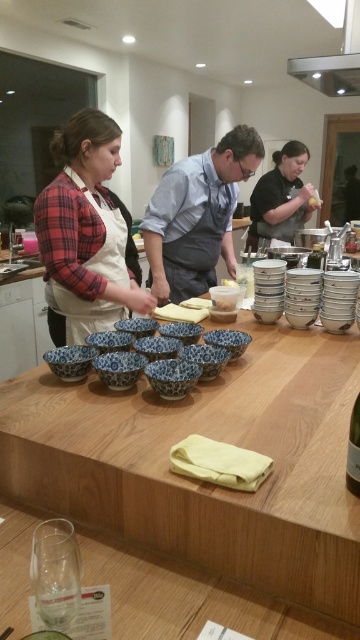
Question: Is wooden table at center to the left of plaid shirt at center from the viewer's perspective?

Choices:
 (A) no
 (B) yes

Answer: (A)

Question: Is wooden table at lower center to the left of blue cotton apron at center from the viewer's perspective?

Choices:
 (A) yes
 (B) no

Answer: (A)

Question: Is plaid shirt at center wider than black matte apron at center?

Choices:
 (A) yes
 (B) no

Answer: (B)

Question: Which point is closer to the camera taking this photo?

Choices:
 (A) tap(261, 342)
 (B) tap(348, 16)
 (C) tap(279, 179)
 (D) tap(173, 586)

Answer: (D)

Question: Which point appears farthest from the camera in this image?

Choices:
 (A) (70, 525)
 (B) (251, 212)
 (C) (151, 612)
 (D) (354, 433)

Answer: (B)

Question: Which point appears farthest from the camera in this image?

Choices:
 (A) (29, 572)
 (B) (334, 92)
 (C) (353, 442)
 (D) (222, 612)

Answer: (B)